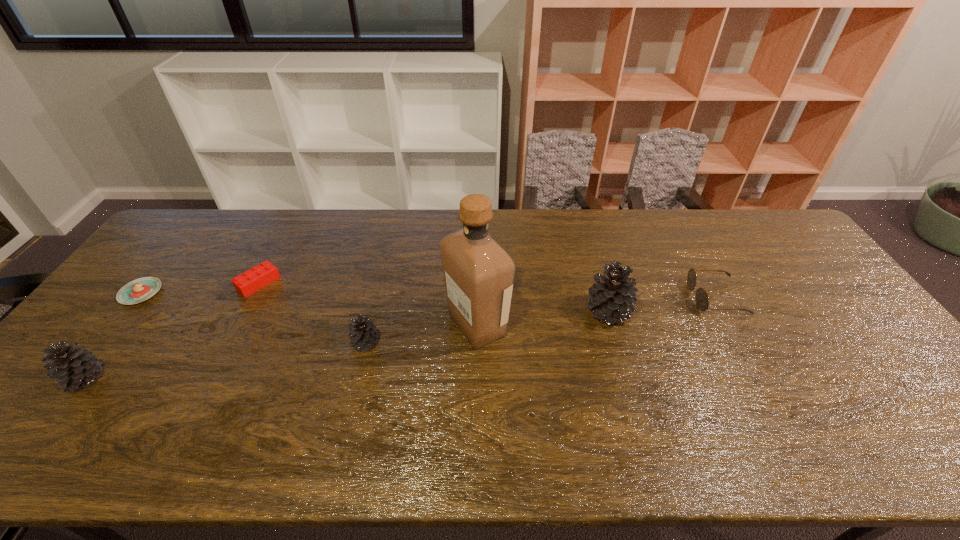
Find the location of a particular element. vacant region located on the lenses of the rightmost object is located at coordinates (555, 298).

Find the location of a particular element. This screenshot has width=960, height=540. blank area located 0.060m on the back of the pastry is located at coordinates (161, 266).

The image size is (960, 540). Find the location of `object that is at the near edge`. object that is at the near edge is located at coordinates (74, 367).

The width and height of the screenshot is (960, 540). What are the coordinates of `pinecone at the left edge` in the screenshot? It's located at (74, 367).

This screenshot has width=960, height=540. Find the location of `pastry at the left edge`. pastry at the left edge is located at coordinates (139, 290).

You are a GUI agent. You are given a task and a screenshot of the screen. Output one action in this format:
    pyautogui.click(x=<x>, y=<y>)
    Task: Click on the object present at the near left corner
    The width and height of the screenshot is (960, 540).
    Given the screenshot: What is the action you would take?
    pyautogui.click(x=74, y=367)

You are a GUI agent. You are given a task and a screenshot of the screen. Output one action in this format:
    pyautogui.click(x=<x>, y=<y>)
    Task: Click on the free region at the far edge of the desktop
    
    Given the screenshot: What is the action you would take?
    pyautogui.click(x=350, y=211)

The image size is (960, 540). What are the coordinates of `vacant space at the near edge of the desktop` in the screenshot? It's located at pyautogui.click(x=567, y=397).

Locate an element on the screen. vacant space at the left edge of the desktop is located at coordinates (154, 297).

I want to click on free space at the right edge of the desktop, so click(846, 352).